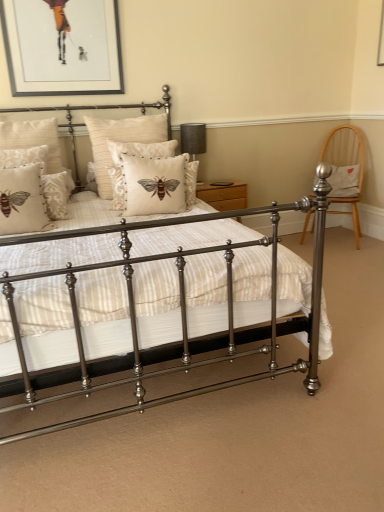
Question: Can you confirm if beige damask pillow at left, arranged as the seventh pillow when viewed from the right, is positioned to the left of matte wood nightstand at center?

Choices:
 (A) yes
 (B) no

Answer: (A)

Question: Does beige damask pillow at left, which is the first pillow in left-to-right order, have a lesser height compared to matte wood nightstand at center?

Choices:
 (A) no
 (B) yes

Answer: (A)

Question: Is beige damask pillow at left, arranged as the seventh pillow when viewed from the right, closer to the viewer compared to matte wood nightstand at center?

Choices:
 (A) yes
 (B) no

Answer: (A)

Question: From a real-world perspective, does beige damask pillow at left, which is the first pillow in left-to-right order, sit lower than matte wood nightstand at center?

Choices:
 (A) yes
 (B) no

Answer: (B)

Question: Is beige damask pillow at left, which is the first pillow in left-to-right order, next to matte wood nightstand at center?

Choices:
 (A) yes
 (B) no

Answer: (B)

Question: Is beige textured pillow with bee design at center, the third pillow positioned from the right, taller or shorter than black fabric table lamp at upper center?

Choices:
 (A) tall
 (B) short

Answer: (A)

Question: From the image's perspective, is beige textured pillow with bee design at center, which ranks as the 5th pillow in left-to-right order, above or below black fabric table lamp at upper center?

Choices:
 (A) above
 (B) below

Answer: (B)

Question: In terms of size, does beige textured pillow with bee design at center, which ranks as the 5th pillow in left-to-right order, appear bigger or smaller than black fabric table lamp at upper center?

Choices:
 (A) big
 (B) small

Answer: (A)

Question: Is beige textured pillow with bee design at center, which ranks as the 5th pillow in left-to-right order, inside the boundaries of black fabric table lamp at upper center, or outside?

Choices:
 (A) inside
 (B) outside

Answer: (B)

Question: From the image's perspective, is white fabric pillow at right, the 1th pillow positioned from the right, above or below black fabric table lamp at upper center?

Choices:
 (A) above
 (B) below

Answer: (B)

Question: Is white fabric pillow at right, the seventh pillow when ordered from left to right, wider or thinner than black fabric table lamp at upper center?

Choices:
 (A) wide
 (B) thin

Answer: (A)

Question: In terms of size, does white fabric pillow at right, the 1th pillow positioned from the right, appear bigger or smaller than black fabric table lamp at upper center?

Choices:
 (A) small
 (B) big

Answer: (B)

Question: In the image, is white fabric pillow at right, the seventh pillow when ordered from left to right, positioned in front of or behind black fabric table lamp at upper center?

Choices:
 (A) behind
 (B) front

Answer: (A)

Question: Is black fabric table lamp at upper center bigger or smaller than matte cream pillow at left, arranged as the 4th pillow when viewed from the right?

Choices:
 (A) small
 (B) big

Answer: (B)

Question: Is point (195, 154) closer or farther from the camera than point (62, 195)?

Choices:
 (A) closer
 (B) farther

Answer: (B)